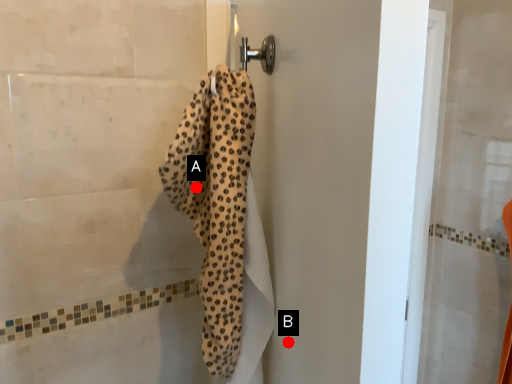
Question: Two points are circled on the image, labeled by A and B beside each circle. Which point appears closest to the camera in this image?

Choices:
 (A) A is closer
 (B) B is closer

Answer: (B)